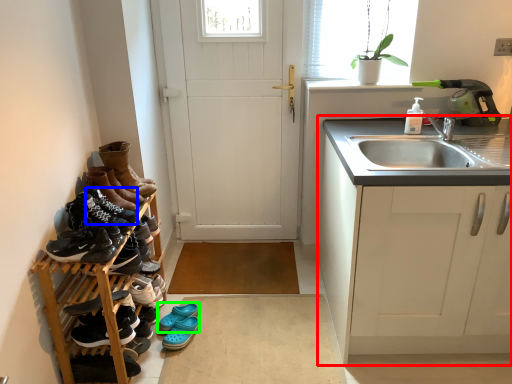
Question: Based on their relative distances, which object is farther from cabinetry (highlighted by a red box)? Choose from shoe (highlighted by a blue box) and footwear (highlighted by a green box).

Choices:
 (A) shoe
 (B) footwear

Answer: (A)